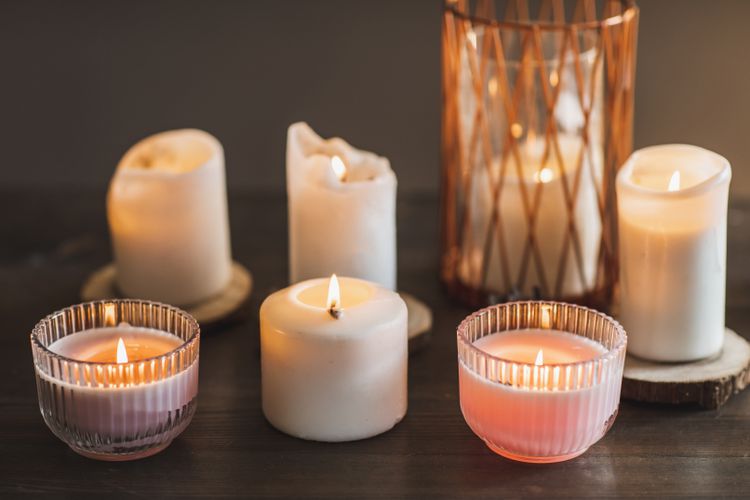
Where is `candles`? This screenshot has height=500, width=750. candles is located at coordinates (90, 350), (153, 230), (316, 208), (324, 341), (507, 344), (654, 258), (560, 221).